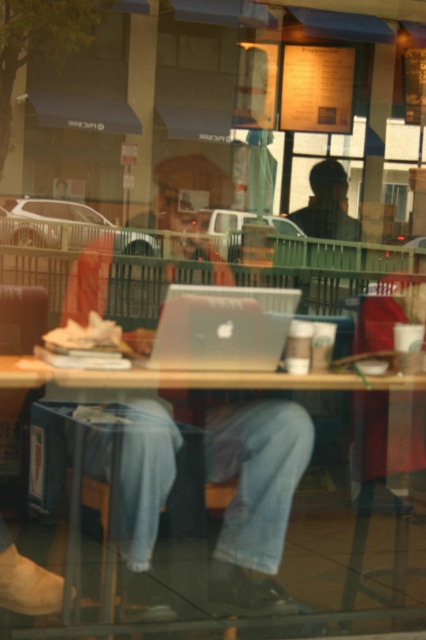
Question: Is wooden table at center further to camera compared to satin silver laptop at center?

Choices:
 (A) yes
 (B) no

Answer: (B)

Question: Which point appears farthest from the camera in this image?

Choices:
 (A) (201, 605)
 (B) (216, 340)

Answer: (B)

Question: Considering the relative positions of wooden table at center and satin silver laptop at center in the image provided, where is wooden table at center located with respect to satin silver laptop at center?

Choices:
 (A) right
 (B) left

Answer: (A)

Question: Can you confirm if wooden table at center is positioned above satin silver laptop at center?

Choices:
 (A) no
 (B) yes

Answer: (A)